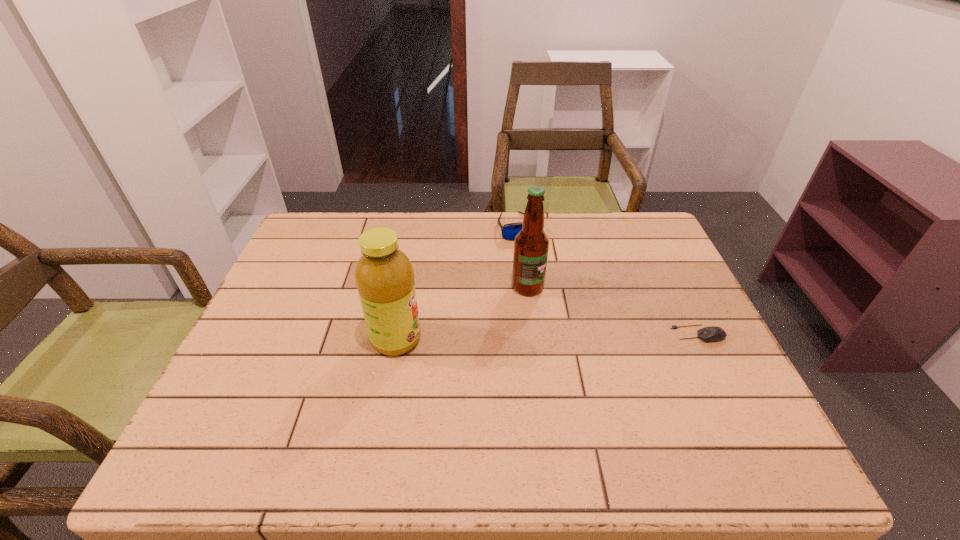
Where is `blank space located 0.290m on the label of the beer bottle`? Image resolution: width=960 pixels, height=540 pixels. blank space located 0.290m on the label of the beer bottle is located at coordinates (615, 372).

Where is `free space located 0.310m on the front-facing side of the farthest object`? The height and width of the screenshot is (540, 960). free space located 0.310m on the front-facing side of the farthest object is located at coordinates (553, 314).

I want to click on free space located 0.180m on the front-facing side of the farthest object, so (x=540, y=280).

Where is `vacant area situated on the front-facing side of the farthest object`? The width and height of the screenshot is (960, 540). vacant area situated on the front-facing side of the farthest object is located at coordinates (548, 300).

Where is `object at the far edge`? object at the far edge is located at coordinates (509, 231).

This screenshot has width=960, height=540. I want to click on object situated at the right edge, so click(714, 333).

In the image, there is a desktop. Where is `vacant space at the far edge`? vacant space at the far edge is located at coordinates [511, 246].

At what (x,y) coordinates should I click in order to perform the action: click on vacant region at the near edge of the desktop. Please return your answer as a coordinate pair (x, y). This screenshot has width=960, height=540. Looking at the image, I should click on (545, 417).

Identify the location of free space at the left edge of the desktop. This screenshot has height=540, width=960. (300, 314).

In the image, there is a desktop. In order to click on vacant space at the right edge in this screenshot , I will do `click(644, 265)`.